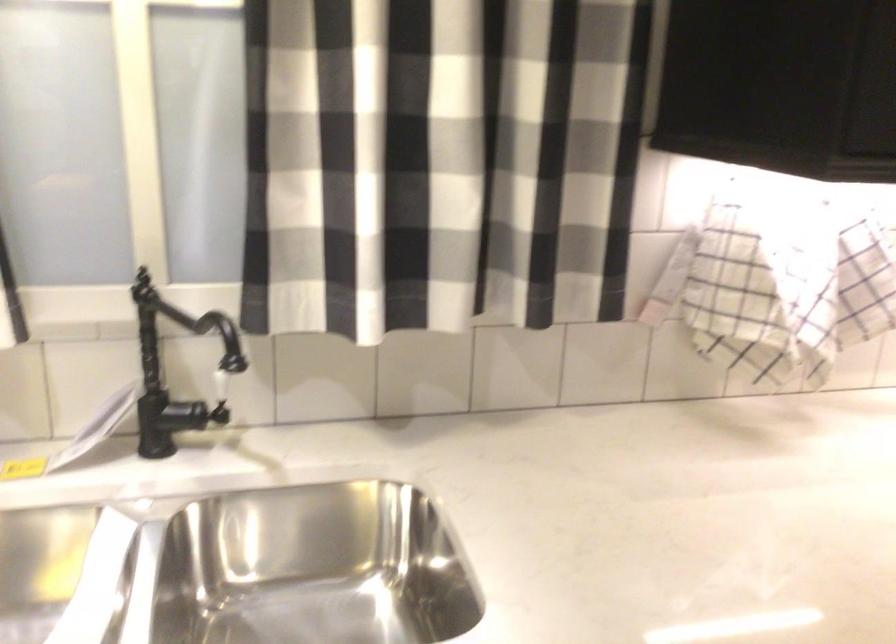
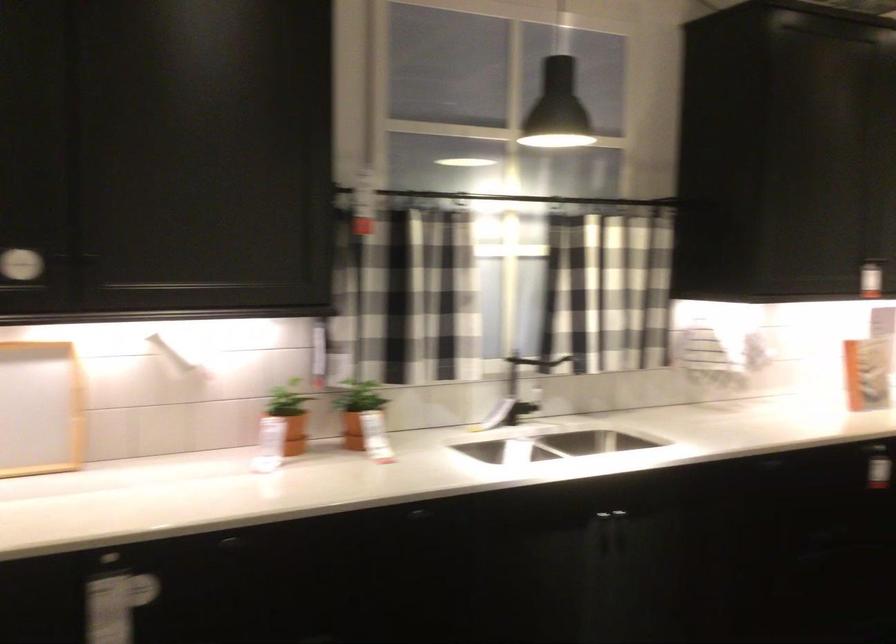
Where in the second image is the point corresponding to the point at 242,314 from the first image?

(538, 366)